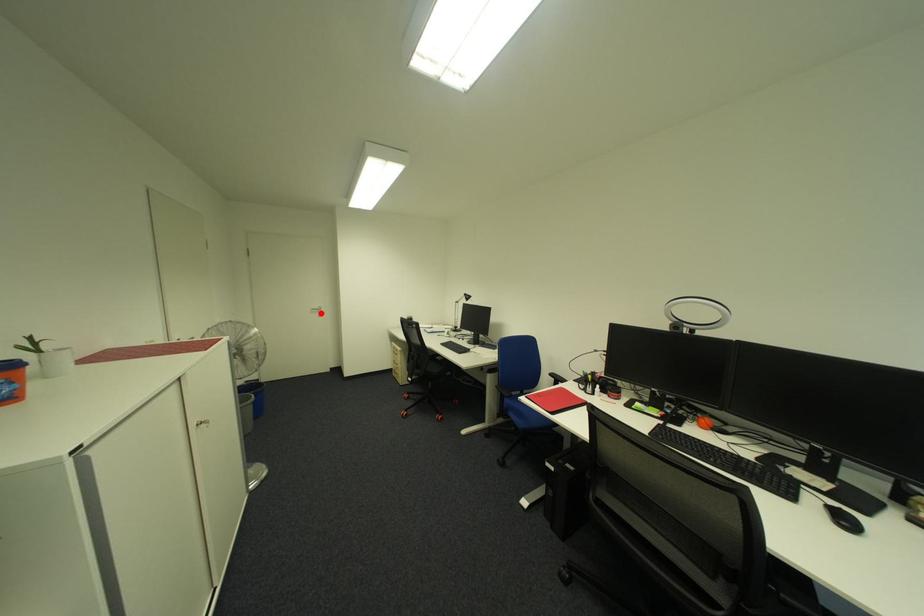
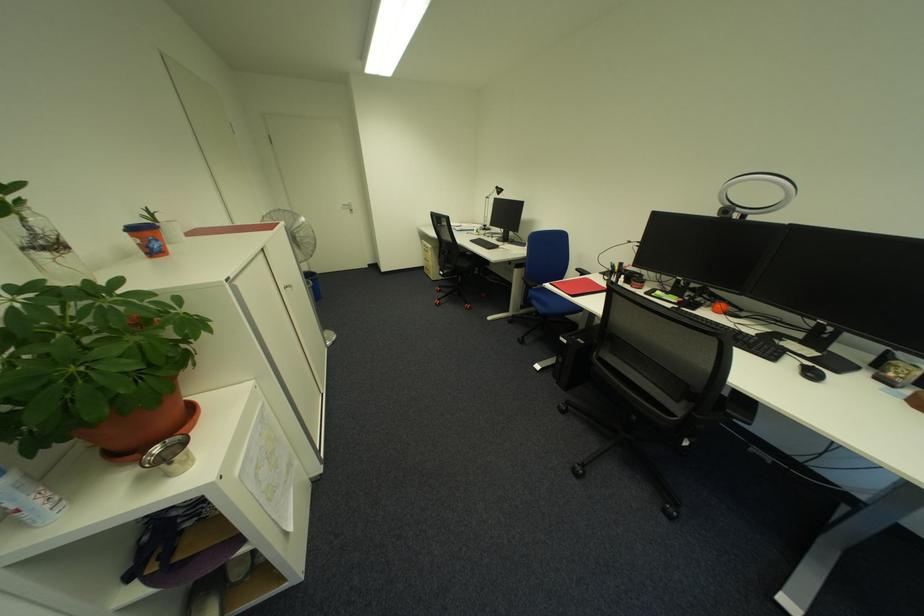
Question: I am providing you with two images of the same scene from different viewpoints. Image1 has a red point marked. In image2, the corresponding 3D location appears at what relative position? Reply with the corresponding letter.

Choices:
 (A) Closer
 (B) Farther

Answer: (A)